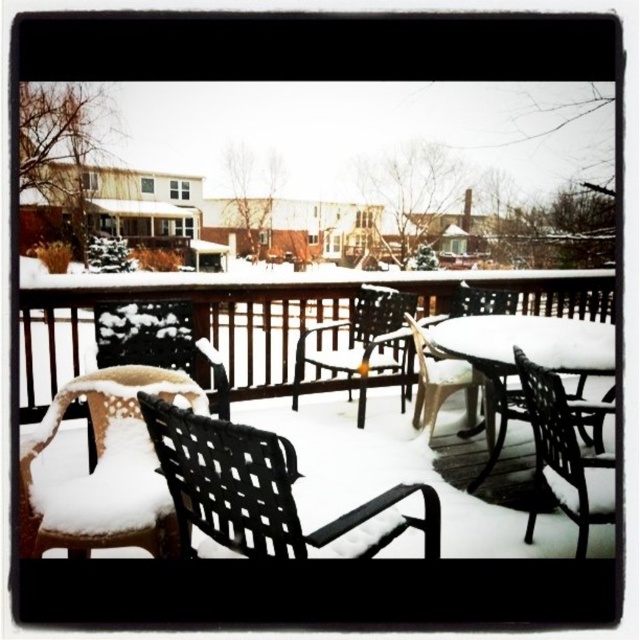
Does white woven chair at lower left have a lesser height compared to black plastic chair at center?

No.

Is white woven chair at lower left bigger than black plastic chair at center?

Yes.

Identify the location of white woven chair at lower left. The width and height of the screenshot is (640, 640). (108, 468).

Image resolution: width=640 pixels, height=640 pixels. In order to click on white woven chair at lower left in this screenshot , I will do `click(108, 468)`.

Describe the element at coordinates (108, 468) in the screenshot. This screenshot has height=640, width=640. I see `white woven chair at lower left` at that location.

Can you confirm if white woven chair at lower left is wider than white plastic table at center?

In fact, white woven chair at lower left might be narrower than white plastic table at center.

Is point (152, 502) closer to camera compared to point (461, 323)?

Yes, it is.

This screenshot has height=640, width=640. I want to click on white woven chair at lower left, so [108, 468].

Does point (244, 497) lie in front of point (584, 532)?

Yes, it is.

What do you see at coordinates (257, 488) in the screenshot? I see `black woven chair at lower left` at bounding box center [257, 488].

Locate an element on the screen. Image resolution: width=640 pixels, height=640 pixels. black woven chair at lower left is located at coordinates (257, 488).